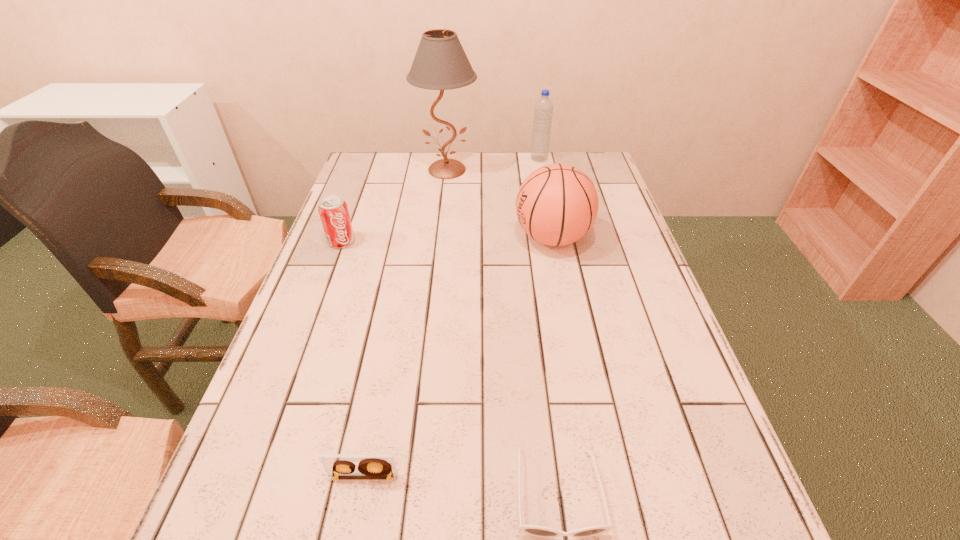
The width and height of the screenshot is (960, 540). I want to click on table lamp, so click(x=440, y=63).

Identify the location of water bottle. (543, 109).

At what (x,y) coordinates should I click in order to perform the action: click on basketball. Please return your answer as a coordinate pair (x, y). Looking at the image, I should click on (557, 204).

Where is `soda can`? The width and height of the screenshot is (960, 540). soda can is located at coordinates (333, 210).

The width and height of the screenshot is (960, 540). I want to click on the leftmost object, so click(x=333, y=210).

At what (x,y) coordinates should I click in order to perform the action: click on the second shortest object. Please return your answer as a coordinate pair (x, y). Looking at the image, I should click on (337, 466).

Image resolution: width=960 pixels, height=540 pixels. In order to click on free spot located on the front-facing side of the table lamp in this screenshot , I will do `click(438, 252)`.

What are the coordinates of `vacant space located on the left of the water bottle` in the screenshot? It's located at (484, 159).

Where is `vacant area located on the surface of the basketball near the brand logo`? The image size is (960, 540). vacant area located on the surface of the basketball near the brand logo is located at coordinates (481, 238).

This screenshot has height=540, width=960. Find the location of `free space located on the surface of the basketball near the brand logo`. free space located on the surface of the basketball near the brand logo is located at coordinates (369, 238).